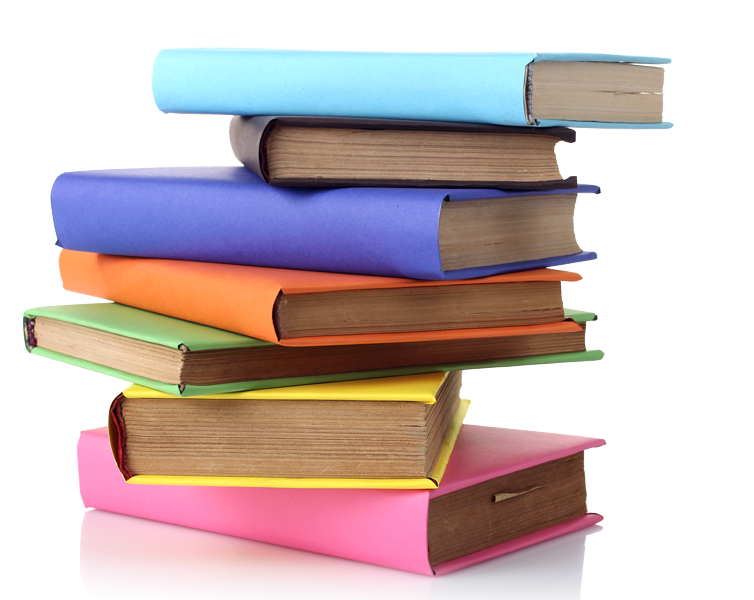
What are the coordinates of `book spines` in the screenshot? It's located at (357, 526), (181, 300), (244, 229), (238, 138), (287, 88).